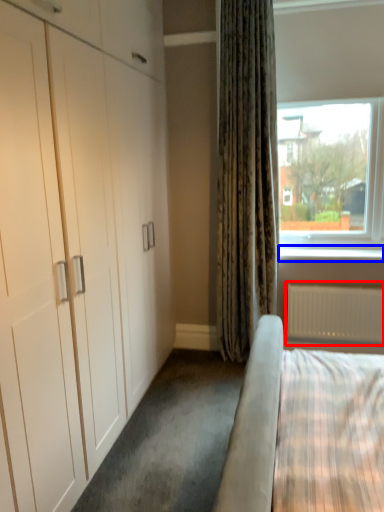
Question: Which point is closer to the camera, radiator (highlighted by a red box) or window sill (highlighted by a blue box)?

Choices:
 (A) radiator
 (B) window sill

Answer: (A)